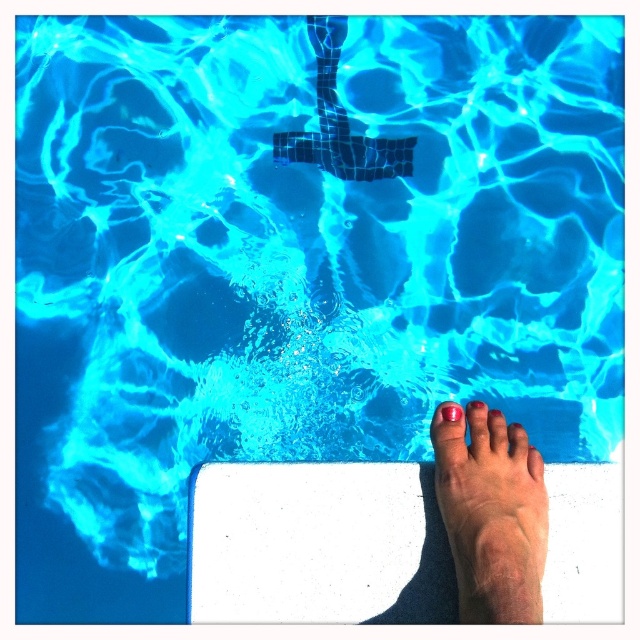
Question: Which point appears closest to the camera in this image?

Choices:
 (A) (541, 460)
 (B) (502, 547)

Answer: (B)

Question: Does smooth skin foot at lower right appear under pink matte nail at center?

Choices:
 (A) yes
 (B) no

Answer: (A)

Question: Which point appears farthest from the camera in this image?

Choices:
 (A) (541, 532)
 (B) (531, 451)

Answer: (B)

Question: Which object is closer to the camera taking this photo?

Choices:
 (A) smooth skin foot at lower right
 (B) pink glossy toe at lower right
 (C) pink matte nail at center

Answer: (A)

Question: Can you confirm if smooth skin foot at lower right is positioned below pink matte nail at center?

Choices:
 (A) yes
 (B) no

Answer: (A)

Question: Can you confirm if smooth skin foot at lower right is positioned above pink glossy toe at lower right?

Choices:
 (A) no
 (B) yes

Answer: (A)